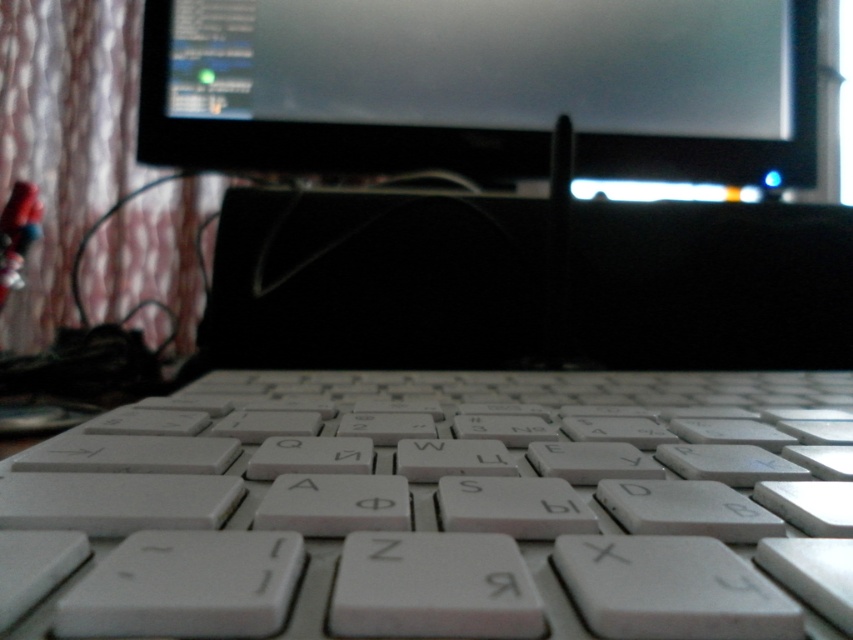
You are a photographer adjusting your camera settings to capture the two points on the keyboard. Which point is closer to your camera lens, point(286,563) or point(184,115)?

Point(286,563) is closer to the camera lens than point(184,115).

You are a photographer trying to capture a detailed shot of the keyboard in the image. You want to ensure that the point at point (325, 433) is in focus. Given that your camera has a depth of field that can focus on objects within 18 inches of the current focal point, where should you set your focal point to ensure this specific point is sharp?

You should set the focal point at point (325, 433) since it is exactly 18.37 inches away from the camera, which is within the camera depth of field range of 18 inches. This will ensure the point is in focus.

You are setting up a laptop on a small desk that can only accommodate items up to 10 cm in thickness. You have the white plastic keyboard at center and the black glossy monitor at upper center. Which item can fit on the desk based on their thickness?

The white plastic keyboard at center is thinner than the black glossy monitor at upper center, so the keyboard can fit on the desk since it meets the 10 cm thickness requirement, but the monitor might exceed it.